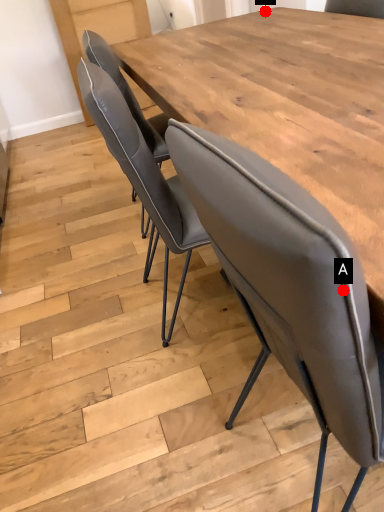
Question: Two points are circled on the image, labeled by A and B beside each circle. Which point is farther from the camera taking this photo?

Choices:
 (A) A is further
 (B) B is further

Answer: (B)